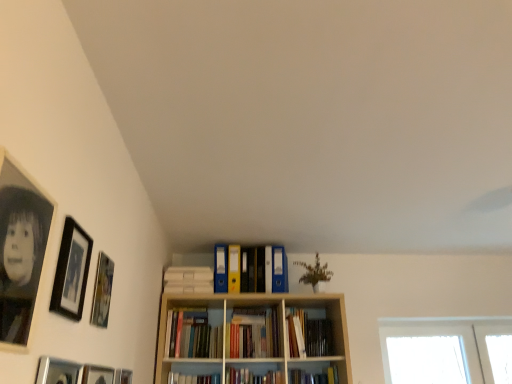
Question: Would you consider black matte picture frame at upper left, placed as the 4th picture frame when sorted from back to front, to be distant from matte plastic folders at center, the 3th book in the bottom-to-top sequence?

Choices:
 (A) yes
 (B) no

Answer: (A)

Question: Is black matte picture frame at upper left, the 3th picture frame when ordered from front to back, shorter than matte plastic folders at center, the 3th book in the bottom-to-top sequence?

Choices:
 (A) no
 (B) yes

Answer: (B)

Question: Considering the relative positions of black matte picture frame at upper left, placed as the 4th picture frame when sorted from back to front, and matte plastic folders at center, the 3th book in the bottom-to-top sequence, in the image provided, is black matte picture frame at upper left, placed as the 4th picture frame when sorted from back to front, to the right of matte plastic folders at center, the 3th book in the bottom-to-top sequence, from the viewer's perspective?

Choices:
 (A) yes
 (B) no

Answer: (B)

Question: Would you say black matte picture frame at upper left, placed as the 4th picture frame when sorted from back to front, contains matte plastic folders at center, the 3th book in the bottom-to-top sequence?

Choices:
 (A) no
 (B) yes

Answer: (A)

Question: Considering the relative sizes of black matte picture frame at upper left, the 3th picture frame when ordered from front to back, and matte plastic folders at center, the first book in the top-to-bottom sequence, in the image provided, is black matte picture frame at upper left, the 3th picture frame when ordered from front to back, thinner than matte plastic folders at center, the first book in the top-to-bottom sequence,?

Choices:
 (A) yes
 (B) no

Answer: (A)

Question: From the image's perspective, is matte wooden picture frame at left, which ranks as the 5th picture frame in front-to-back order, above or below matte plastic folders at center, the 3th book in the bottom-to-top sequence?

Choices:
 (A) below
 (B) above

Answer: (B)

Question: Considering the positions of matte wooden picture frame at left, which ranks as the 2th picture frame in back-to-front order, and matte plastic folders at center, the first book in the top-to-bottom sequence, in the image, is matte wooden picture frame at left, which ranks as the 2th picture frame in back-to-front order, taller or shorter than matte plastic folders at center, the first book in the top-to-bottom sequence,?

Choices:
 (A) short
 (B) tall

Answer: (A)

Question: In the image, is matte wooden picture frame at left, which ranks as the 2th picture frame in back-to-front order, on the left side or the right side of matte plastic folders at center, the 3th book in the bottom-to-top sequence?

Choices:
 (A) left
 (B) right

Answer: (A)

Question: Does point (98, 258) appear closer or farther from the camera than point (246, 278)?

Choices:
 (A) closer
 (B) farther

Answer: (A)

Question: Does point (104, 271) appear closer or farther from the camera than point (292, 319)?

Choices:
 (A) closer
 (B) farther

Answer: (A)

Question: From the image's perspective, is matte wooden picture frame at left, which ranks as the 5th picture frame in front-to-back order, located above or below hardcover books at center, the 2th book when ordered from bottom to top?

Choices:
 (A) below
 (B) above

Answer: (B)

Question: Based on their positions, is matte wooden picture frame at left, which ranks as the 2th picture frame in back-to-front order, located to the left or right of hardcover books at center, placed as the 2th book when sorted from top to bottom?

Choices:
 (A) left
 (B) right

Answer: (A)

Question: Looking at their shapes, would you say matte wooden picture frame at left, which ranks as the 2th picture frame in back-to-front order, is wider or thinner than hardcover books at center, placed as the 2th book when sorted from top to bottom?

Choices:
 (A) wide
 (B) thin

Answer: (B)

Question: Is green matte plant at upper center situated inside matte wooden picture frame at left, which ranks as the 5th picture frame in front-to-back order, or outside?

Choices:
 (A) inside
 (B) outside

Answer: (B)

Question: Based on their positions, is green matte plant at upper center located to the left or right of matte wooden picture frame at left, which ranks as the 2th picture frame in back-to-front order?

Choices:
 (A) right
 (B) left

Answer: (A)